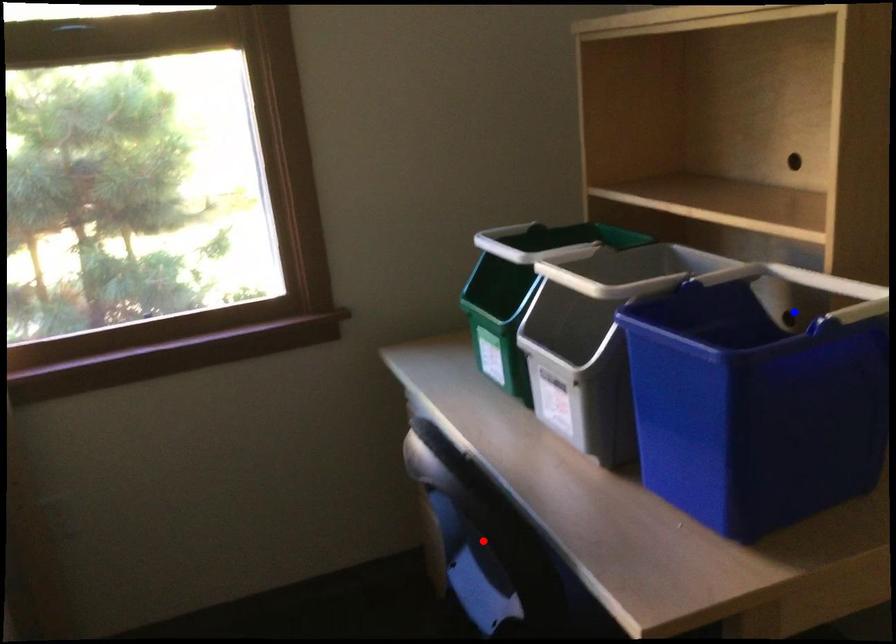
Question: Which of the two points in the image is closer to the camera?

Choices:
 (A) Blue point is closer.
 (B) Red point is closer.

Answer: (B)